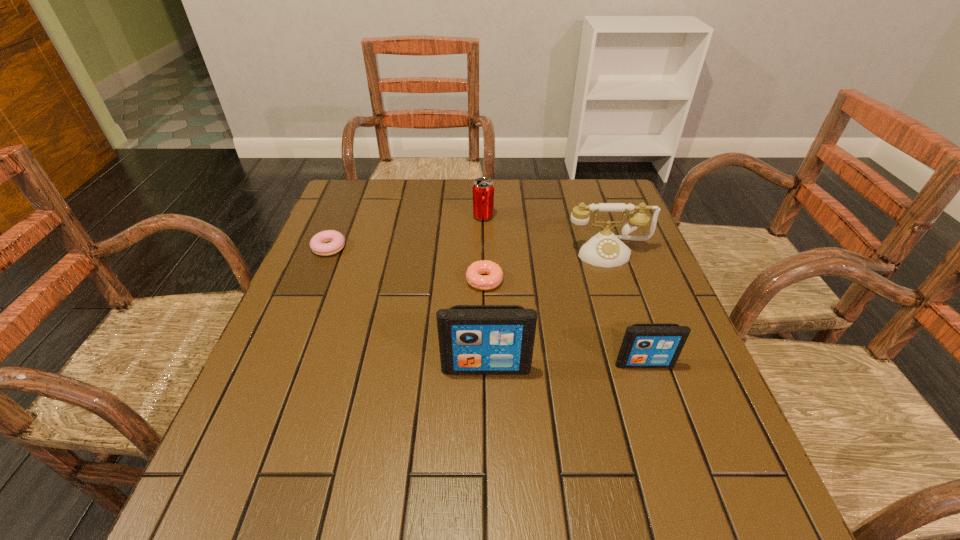
Find the location of a particular element. vacant area between the soda can and the telephone is located at coordinates (545, 234).

You are a GUI agent. You are given a task and a screenshot of the screen. Output one action in this format:
    pyautogui.click(x=<x>, y=<y>)
    Task: Click on the vacant area between the leftmost object and the telephone
    The width and height of the screenshot is (960, 540).
    Given the screenshot: What is the action you would take?
    pyautogui.click(x=468, y=250)

Where is `empty location between the leftmost object and the nearer doughnut`? empty location between the leftmost object and the nearer doughnut is located at coordinates (407, 264).

Identify the location of object that is the nearest to the farthest object. The image size is (960, 540). (604, 249).

At what (x,y) coordinates should I click in order to perform the action: click on object that is the closest one to the leftmost object. Please return your answer as a coordinate pair (x, y). Looking at the image, I should click on (473, 274).